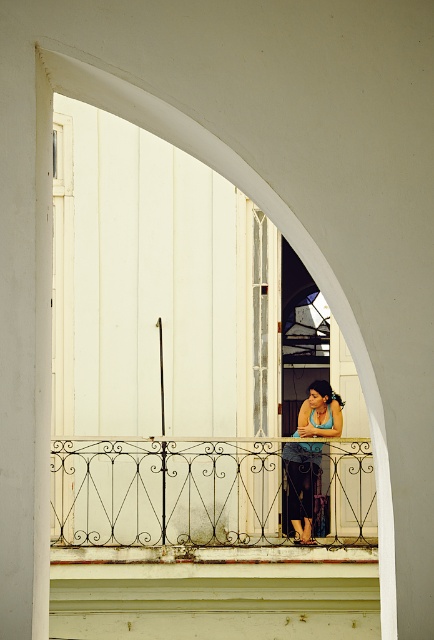
You are standing in front of an arched doorway and want to take a photo of the woman on the balcony. The camera you are using has a focal length of 50mm and a sensor size of 36mm. If the woman is at point (359, 344), which is 5.91 meters away from the camera, what is the angle of view required to capture her in the frame?

The angle of view required to capture the woman at point (359, 344), which is 5.91 meters away from the camera, can be calculated using the formula for angle of view. The formula is 2 arctan sensor size divided by 2 multiplied by focal length. Plugging in the values, the angle of view is approximately 2 arctan 36 divided by 2 times 50, which gives an angle of approximately 40 degrees. This angle should ensure the woman is within the frame.

In the scene shown: You are standing in front of the arched doorway and want to know the exact location of the white wrought iron balustrade at center. According to the coordinates given, where is it located?

The white wrought iron balustrade at center is located at point (171, 492).